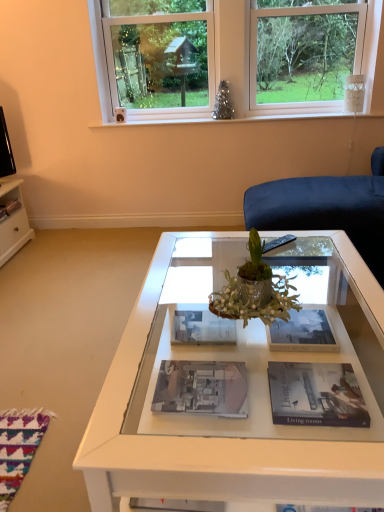
This screenshot has width=384, height=512. I want to click on free space above matte paper magazine at center, the 2th magazine positioned from the top (from a real-world perspective), so click(291, 326).